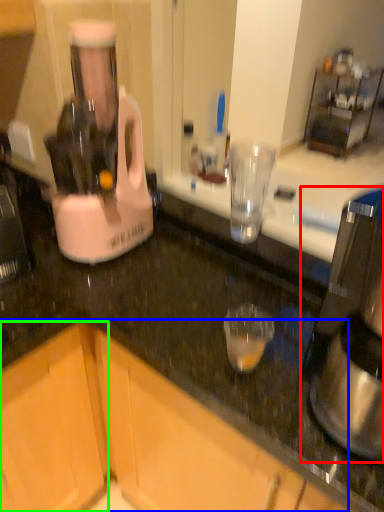
Question: Considering the real-world distances, which object is closest to coffee maker (highlighted by a red box)? cabinetry (highlighted by a blue box) or cabinetry (highlighted by a green box).

Choices:
 (A) cabinetry
 (B) cabinetry

Answer: (A)